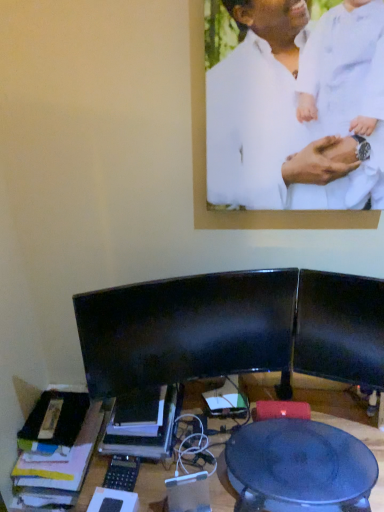
Find the location of a particular element. The height and width of the screenshot is (512, 384). white matte shirt at upper center is located at coordinates (267, 132).

In order to face black glossy monitor at center, should I rotate leftwards or rightwards?

It's best to rotate right around 0.255 degrees.

At what (x,y) coordinates should I click in order to perform the action: click on matte black table at center. Please return your answer as a coordinate pair (x, y). This screenshot has height=512, width=384. Looking at the image, I should click on (299, 467).

Which object is more forward, matte black table at center or white matte shirt at upper center?

Positioned in front is white matte shirt at upper center.

Is matte black table at center oriented away from white matte shirt at upper center?

No, matte black table at center is not facing away from white matte shirt at upper center.

Are matte black table at center and white matte shirt at upper center far apart?

No, matte black table at center is not far away from white matte shirt at upper center.

Which is farther from the camera, (315, 480) or (263, 125)?

The point (315, 480) is farther.

Which is more to the left, white matte shirt at upper center or matte black table at center?

Positioned to the left is white matte shirt at upper center.

Considering the points (252, 86) and (267, 442), which point is behind, point (252, 86) or point (267, 442)?

Positioned behind is point (267, 442).

Is white matte shirt at upper center completely or partially outside of matte black table at center?

That's correct, white matte shirt at upper center is outside of matte black table at center.

Which object is more forward, white matte shirt at upper center or black glossy monitor at center?

white matte shirt at upper center is in front.

From a real-world perspective, is white matte shirt at upper center positioned above or below black glossy monitor at center?

white matte shirt at upper center is above black glossy monitor at center.

Is white matte shirt at upper center facing away from black glossy monitor at center?

No.

Considering their positions, is black glossy monitor at center located in front of or behind white matte shirt at upper center?

black glossy monitor at center is positioned farther from the viewer than white matte shirt at upper center.

Would you say black glossy monitor at center is inside or outside white matte shirt at upper center?

black glossy monitor at center is spatially situated outside white matte shirt at upper center.

Who is bigger, black glossy monitor at center or white matte shirt at upper center?

Bigger between the two is black glossy monitor at center.

From the image's perspective, is black glossy monitor at center located above white matte shirt at upper center?

No, from the image's perspective, black glossy monitor at center is not on top of white matte shirt at upper center.

Is matte black table at center positioned far away from black glossy monitor at center?

Actually, matte black table at center and black glossy monitor at center are a little close together.

This screenshot has height=512, width=384. In the image, there is a matte black table at center. What are the coordinates of `computer monitor above it (from the image's perspective)` in the screenshot? It's located at (187, 330).

From the picture: Is matte black table at center wider or thinner than black glossy monitor at center?

Clearly, matte black table at center has more width compared to black glossy monitor at center.

Is matte black table at center at the left side of black glossy monitor at center?

No, matte black table at center is not to the left of black glossy monitor at center.

Where is `computer monitor that is on the left side of matte black table at center`? computer monitor that is on the left side of matte black table at center is located at coordinates (187, 330).

Is black glossy monitor at center thinner than matte black table at center?

Correct, the width of black glossy monitor at center is less than that of matte black table at center.

Does black glossy monitor at center have a lesser height compared to matte black table at center?

No, black glossy monitor at center is not shorter than matte black table at center.

Is matte black table at center located within black glossy monitor at center?

No, matte black table at center is not surrounded by black glossy monitor at center.

In order to click on round table that is below the white matte shirt at upper center (from the image's perspective) in this screenshot , I will do `click(299, 467)`.

At what (x,y) coordinates should I click in order to perform the action: click on round table on the right side of white matte shirt at upper center. Please return your answer as a coordinate pair (x, y). This screenshot has height=512, width=384. Looking at the image, I should click on (299, 467).

Looking at the image, which one is located further to black glossy monitor at center, matte black table at center or white matte shirt at upper center?

Among the two, white matte shirt at upper center is located further to black glossy monitor at center.

Looking at the image, which one is located closer to black glossy monitor at center, white matte shirt at upper center or matte black table at center?

Among the two, matte black table at center is located nearer to black glossy monitor at center.

Looking at the image, which one is located further to matte black table at center, white matte shirt at upper center or black glossy monitor at center?

white matte shirt at upper center is positioned further to the anchor matte black table at center.

Based on their spatial positions, is black glossy monitor at center or white matte shirt at upper center further from matte black table at center?

Based on the image, white matte shirt at upper center appears to be further to matte black table at center.

Looking at the image, which one is located closer to white matte shirt at upper center, matte black table at center or black glossy monitor at center?

black glossy monitor at center lies closer to white matte shirt at upper center than the other object.

Looking at this image, which object lies nearer to the anchor point white matte shirt at upper center, black glossy monitor at center or matte black table at center?

The object closer to white matte shirt at upper center is black glossy monitor at center.

Identify the location of computer monitor between white matte shirt at upper center and matte black table at center in the vertical direction. (187, 330).